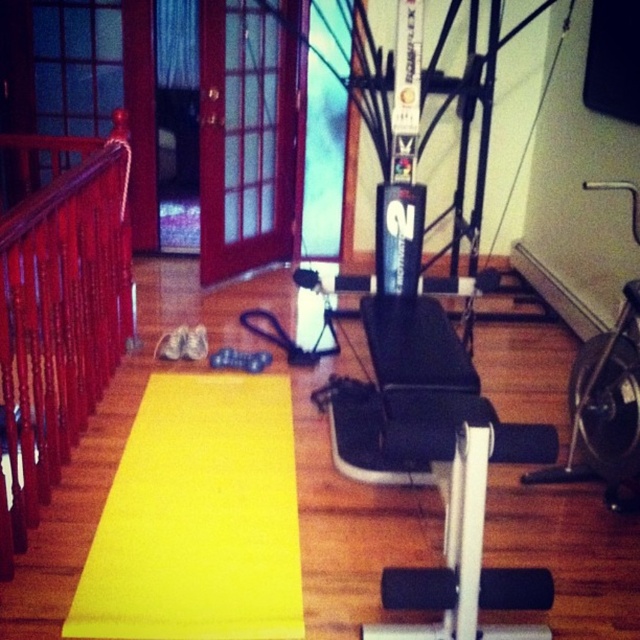
Question: From the image, what is the correct spatial relationship of yellow rubber mat at center in relation to polished wood railing at left?

Choices:
 (A) above
 (B) below

Answer: (B)

Question: Which object appears farthest from the camera in this image?

Choices:
 (A) polished wood railing at left
 (B) yellow rubber mat at center

Answer: (B)

Question: Can you confirm if yellow rubber mat at center is smaller than polished wood railing at left?

Choices:
 (A) no
 (B) yes

Answer: (B)

Question: Which point appears farthest from the camera in this image?

Choices:
 (A) (272, 426)
 (B) (88, 364)

Answer: (A)

Question: Which point appears farthest from the camera in this image?

Choices:
 (A) (184, 392)
 (B) (51, 218)

Answer: (A)

Question: Does yellow rubber mat at center appear on the left side of polished wood railing at left?

Choices:
 (A) no
 (B) yes

Answer: (A)